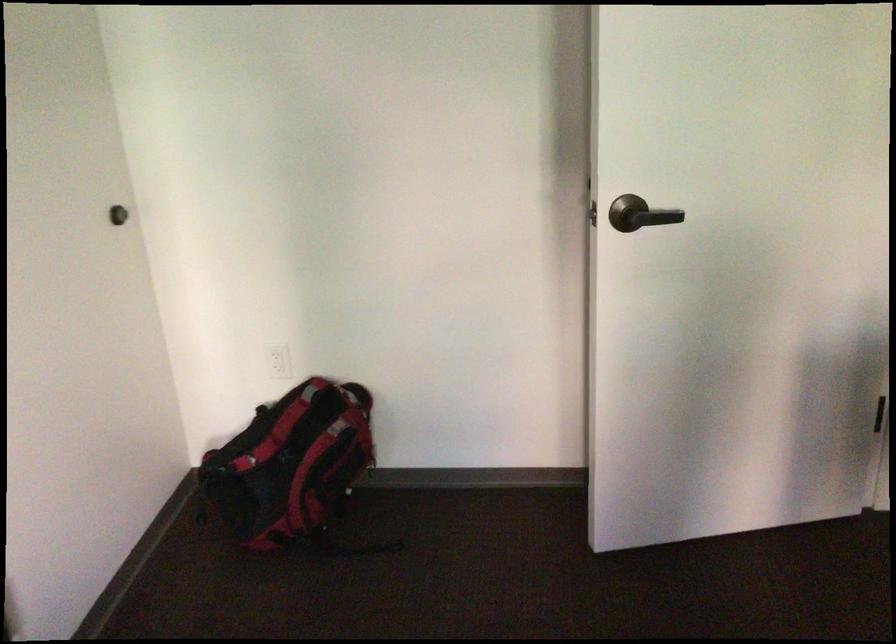
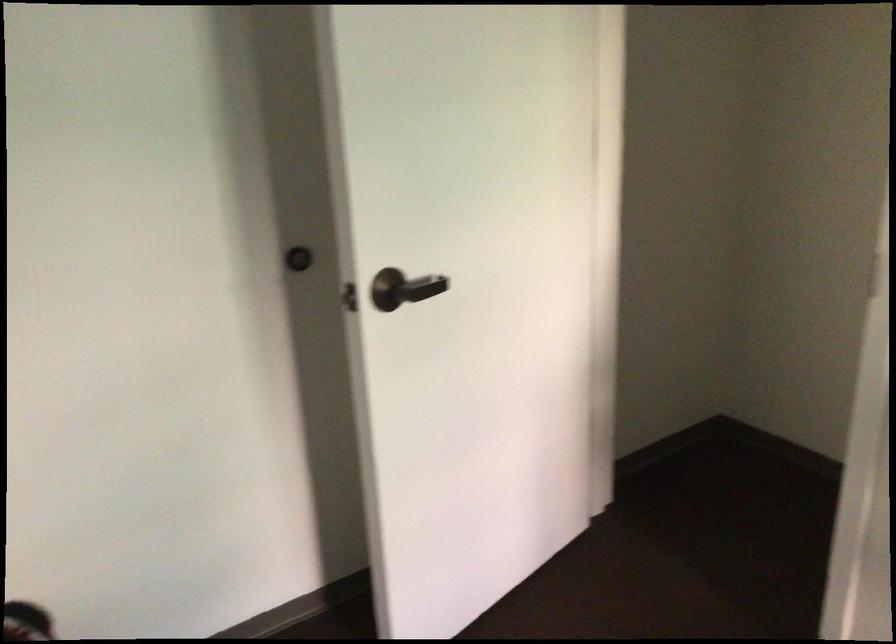
Question: The camera is either moving clockwise (left) or counter-clockwise (right) around the object. The first image is from the beginning of the video and the second image is from the end. Is the camera moving left or right when shooting the video?

Choices:
 (A) Left
 (B) Right

Answer: (A)